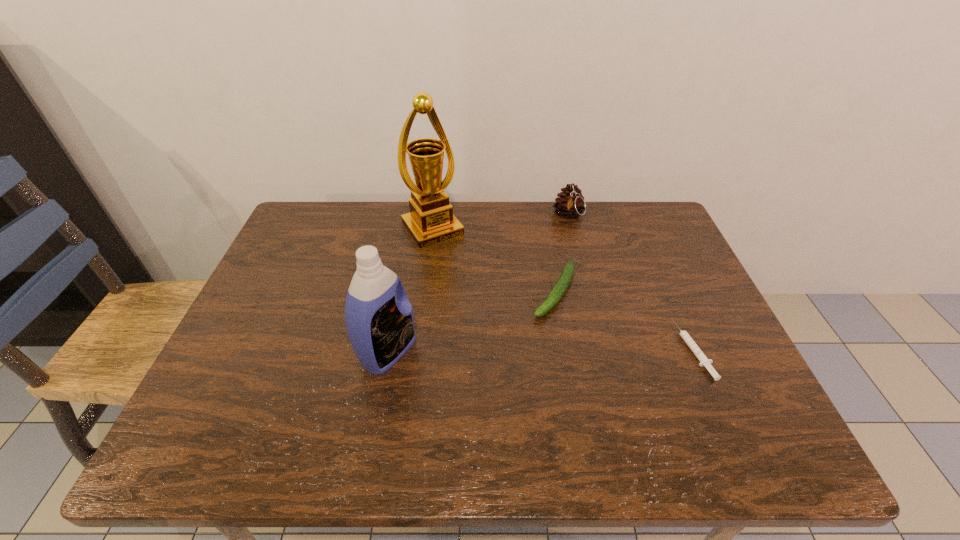
Locate an element on the screen. The width and height of the screenshot is (960, 540). free space located on the front-facing side of the tallest object is located at coordinates (468, 276).

This screenshot has width=960, height=540. I want to click on free space located 0.290m on the front-facing side of the zucchini, so coord(490,408).

Where is `free space located on the front-facing side of the zucchini`? free space located on the front-facing side of the zucchini is located at coordinates (496, 396).

Locate an element on the screen. Image resolution: width=960 pixels, height=540 pixels. free spot located 0.080m on the front-facing side of the zucchini is located at coordinates (533, 339).

Find the location of a particular element. free region located with a leaf charm attached to the pinecone is located at coordinates (576, 272).

In order to click on vacant space located with a leaf charm attached to the pinecone in this screenshot , I will do `click(574, 260)`.

Locate an element on the screen. This screenshot has height=540, width=960. free spot located 0.270m with a leaf charm attached to the pinecone is located at coordinates (578, 287).

Where is `award that is at the far edge`? award that is at the far edge is located at coordinates (431, 221).

The width and height of the screenshot is (960, 540). What are the coordinates of `pinecone at the far edge` in the screenshot? It's located at (569, 203).

At what (x,y) coordinates should I click in order to perform the action: click on detergent at the near edge. Please return your answer as a coordinate pair (x, y). Looking at the image, I should click on (380, 325).